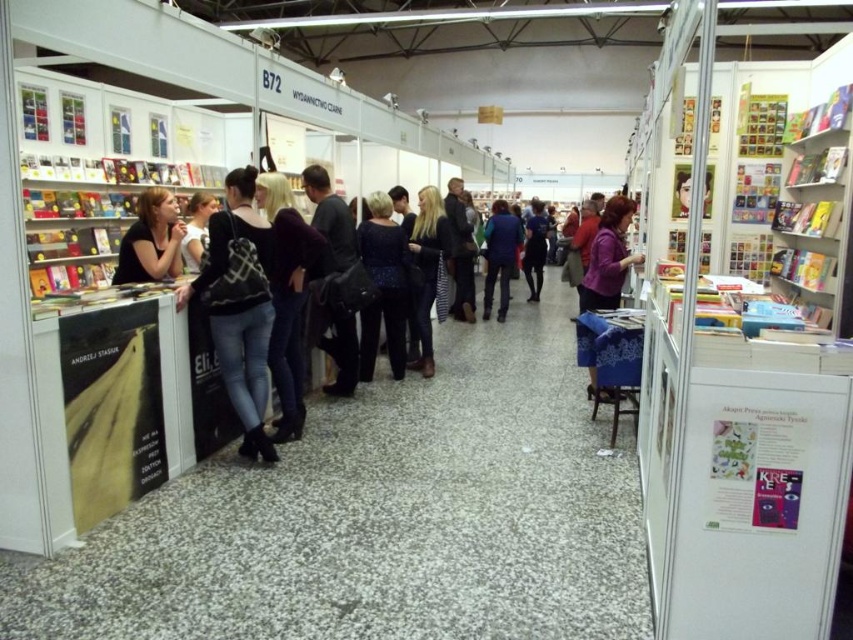
Question: Observing the image, what is the correct spatial positioning of matte black jacket at left in reference to purple fabric skirt at center?

Choices:
 (A) left
 (B) right

Answer: (A)

Question: In this image, where is black textured backpack at left located relative to sparkly blue dress at center?

Choices:
 (A) above
 (B) below

Answer: (B)

Question: Which of the following is the closest to the observer?

Choices:
 (A) black textured backpack at left
 (B) dark blue jeans at center
 (C) dark purple sweater at center
 (D) blonde hair at center

Answer: (A)

Question: Which point is closer to the camera taking this photo?

Choices:
 (A) (309, 237)
 (B) (229, 189)
 (C) (508, 218)
 (D) (592, 392)

Answer: (B)

Question: Is blue denim jeans at center thinner than black leather jacket at center?

Choices:
 (A) yes
 (B) no

Answer: (B)

Question: Which of the following is the closest to the observer?

Choices:
 (A) blue denim jeans at center
 (B) purple fabric skirt at center
 (C) black leather jacket at center
 (D) black textured backpack at left

Answer: (D)